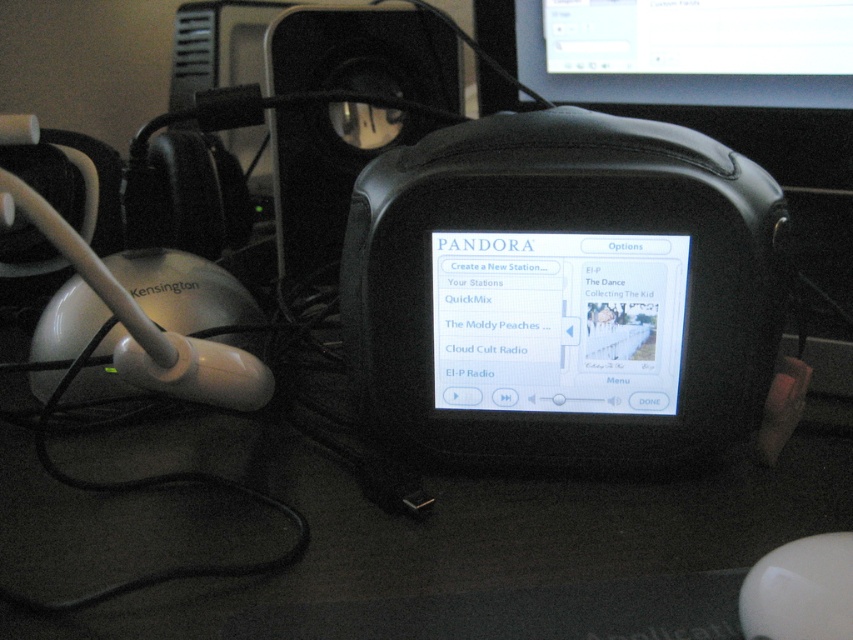
Does matte black screen at center come in front of matte black monitor at upper center?

Yes, matte black screen at center is in front of matte black monitor at upper center.

The width and height of the screenshot is (853, 640). Identify the location of matte black screen at center. (558, 321).

Image resolution: width=853 pixels, height=640 pixels. In order to click on matte black screen at center in this screenshot , I will do `click(558, 321)`.

Can you confirm if matte black monitor at upper center is wider than white glossy mouse at lower right?

Indeed, matte black monitor at upper center has a greater width compared to white glossy mouse at lower right.

Does matte black monitor at upper center appear on the right side of white glossy mouse at lower right?

Correct, you'll find matte black monitor at upper center to the right of white glossy mouse at lower right.

Identify the location of matte black monitor at upper center. (688, 51).

You are a GUI agent. You are given a task and a screenshot of the screen. Output one action in this format:
    pyautogui.click(x=<x>, y=<y>)
    Task: Click on the matte black monitor at upper center
    The width and height of the screenshot is (853, 640).
    Given the screenshot: What is the action you would take?
    pyautogui.click(x=688, y=51)

What do you see at coordinates (688, 51) in the screenshot? I see `matte black monitor at upper center` at bounding box center [688, 51].

Between matte black monitor at upper center and black plastic speaker at center, which one is positioned higher?

matte black monitor at upper center is higher up.

Is point (718, 96) less distant than point (351, 118)?

Yes, point (718, 96) is in front of point (351, 118).

Where is `matte black monitor at upper center`? matte black monitor at upper center is located at coordinates (688, 51).